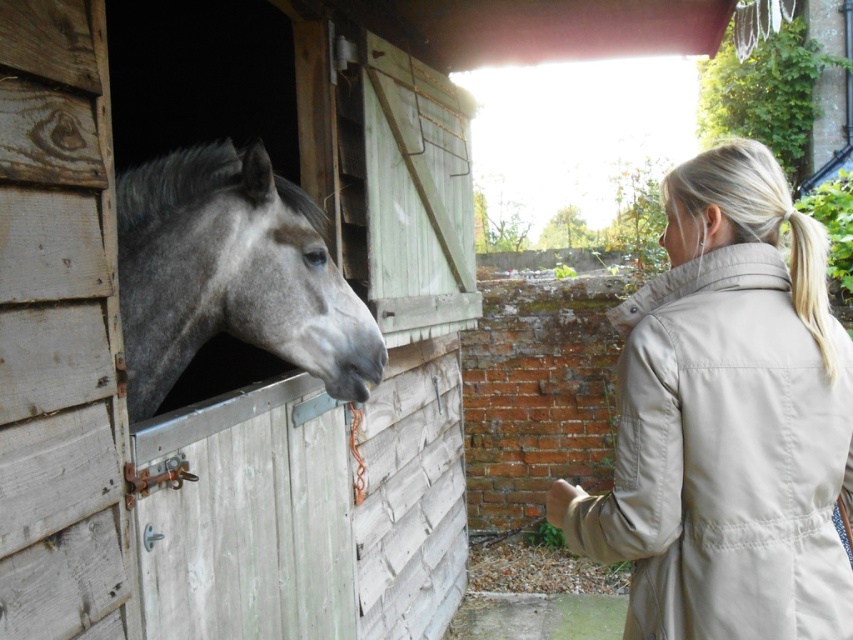
Question: Which is nearer to the matte skin nose at upper center?

Choices:
 (A) beige fabric trench coat at right
 (B) blonde hair at upper right

Answer: (A)

Question: Observing the image, what is the correct spatial positioning of blonde hair at upper right in reference to matte skin nose at upper center?

Choices:
 (A) left
 (B) right

Answer: (A)

Question: Which object is farther from the camera taking this photo?

Choices:
 (A) beige fabric trench coat at right
 (B) blonde hair at upper right
 (C) matte skin nose at upper center
 (D) gray matte horse at left

Answer: (D)

Question: Is beige fabric trench coat at right further to camera compared to gray matte horse at left?

Choices:
 (A) no
 (B) yes

Answer: (A)

Question: Which point is farther to the camera?

Choices:
 (A) matte skin nose at upper center
 (B) beige fabric trench coat at right
 (C) blonde hair at upper right
 (D) gray matte horse at left

Answer: (D)

Question: Does beige fabric trench coat at right have a greater width compared to gray matte horse at left?

Choices:
 (A) yes
 (B) no

Answer: (B)